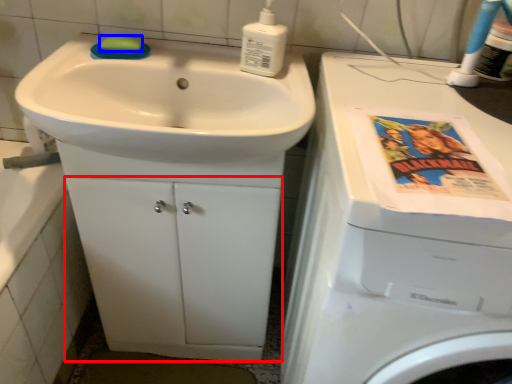
Question: Among these objects, which one is farthest to the camera, drawer (highlighted by a red box) or soap (highlighted by a blue box)?

Choices:
 (A) drawer
 (B) soap

Answer: (B)